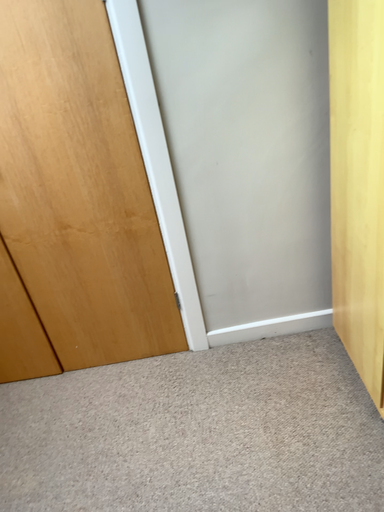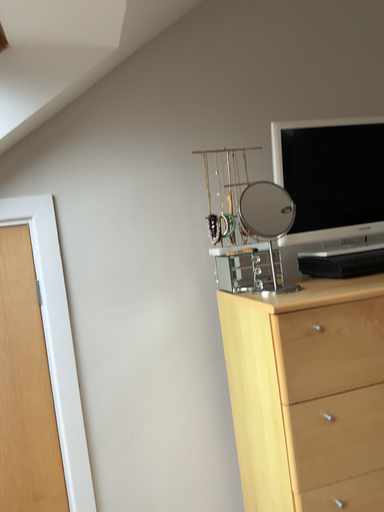
Question: How did the camera likely rotate when shooting the video?

Choices:
 (A) rotated downward
 (B) rotated upward

Answer: (B)